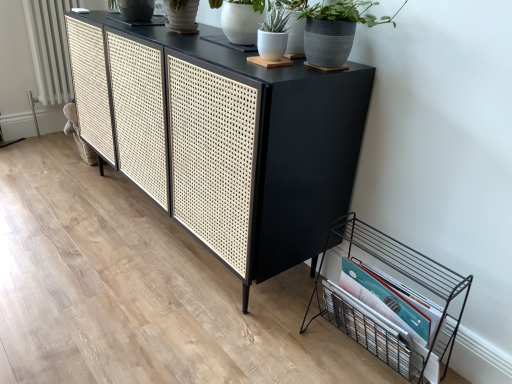
Question: From a real-world perspective, relative to white ceramic pot at upper center, is white textured radiator at left vertically above or below?

Choices:
 (A) above
 (B) below

Answer: (B)

Question: Is point (44, 1) closer or farther from the camera than point (231, 14)?

Choices:
 (A) farther
 (B) closer

Answer: (A)

Question: Which object is positioned farthest from the white textured radiator at left?

Choices:
 (A) white matte pot at upper center, acting as the 1th houseplant starting from the left
 (B) gray matte pot at upper right, acting as the second houseplant starting from the left
 (C) black wire magazine rack at lower right
 (D) black woven cane cabinet at center
 (E) white ceramic pot at upper center

Answer: (C)

Question: Which object is the closest to the black wire magazine rack at lower right?

Choices:
 (A) white matte pot at upper center, which is the second houseplant from right to left
 (B) black woven cane cabinet at center
 (C) white textured radiator at left
 (D) gray matte pot at upper right, which is the 1th houseplant from right to left
 (E) white ceramic pot at upper center

Answer: (B)